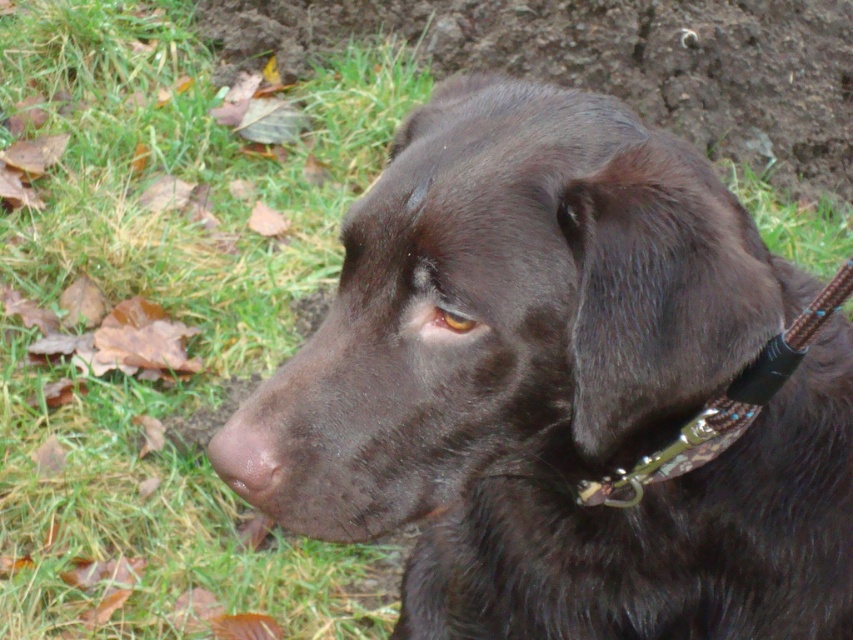
Question: Is green grass at lower left in front of brown smooth nose at center?

Choices:
 (A) yes
 (B) no

Answer: (B)

Question: Does shiny black dog at center have a lesser width compared to green grass at lower left?

Choices:
 (A) no
 (B) yes

Answer: (B)

Question: Which of the following is the closest to the observer?

Choices:
 (A) brown smooth nose at center
 (B) green grass at lower left

Answer: (A)

Question: Which point is farther to the camera?

Choices:
 (A) brown smooth nose at center
 (B) shiny black dog at center
 (C) green grass at lower left

Answer: (C)

Question: Is shiny black dog at center closer to the viewer compared to brown smooth nose at center?

Choices:
 (A) yes
 (B) no

Answer: (A)

Question: Which object is farther from the camera taking this photo?

Choices:
 (A) brown smooth nose at center
 (B) shiny black dog at center
 (C) green grass at lower left

Answer: (C)